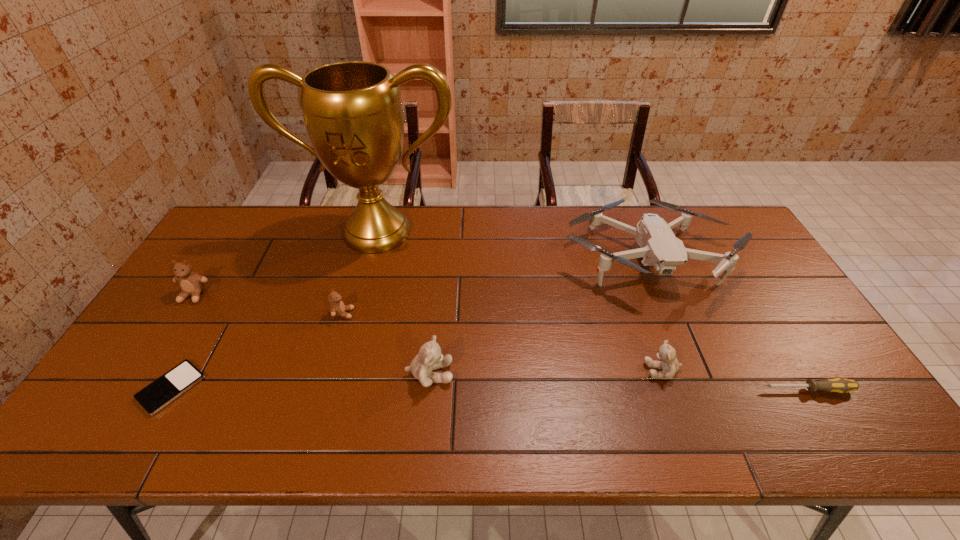
I want to click on vacant space at the far left corner of the desktop, so click(x=264, y=228).

The image size is (960, 540). What are the coordinates of `vacant space at the far right corner of the desktop` in the screenshot? It's located at (725, 221).

Identify the location of free space between the right brown teddy bear and the gray iPod. coord(257,351).

Find the location of a particular element. Image resolution: width=960 pixels, height=540 pixels. empty location between the drone and the second teddy bear from left to right is located at coordinates (494, 286).

This screenshot has width=960, height=540. What are the coordinates of `free spot between the bigger gray teddy bear and the iPod` in the screenshot? It's located at (300, 381).

Locate an element on the screen. The height and width of the screenshot is (540, 960). blank region between the drone and the gray iPod is located at coordinates (409, 323).

Find the location of a particular element. The image size is (960, 540). vacant area that lies between the smaller gray teddy bear and the leftmost teddy bear is located at coordinates (428, 333).

Locate an element on the screen. This screenshot has height=540, width=960. unoccupied area between the drone and the left gray teddy bear is located at coordinates (538, 316).

Where is `free point between the bigger brown teddy bear and the smaller gray teddy bear`? Image resolution: width=960 pixels, height=540 pixels. free point between the bigger brown teddy bear and the smaller gray teddy bear is located at coordinates (428, 333).

The image size is (960, 540). Find the location of `free space between the bigger brown teddy bear and the smaller gray teddy bear`. free space between the bigger brown teddy bear and the smaller gray teddy bear is located at coordinates (428, 333).